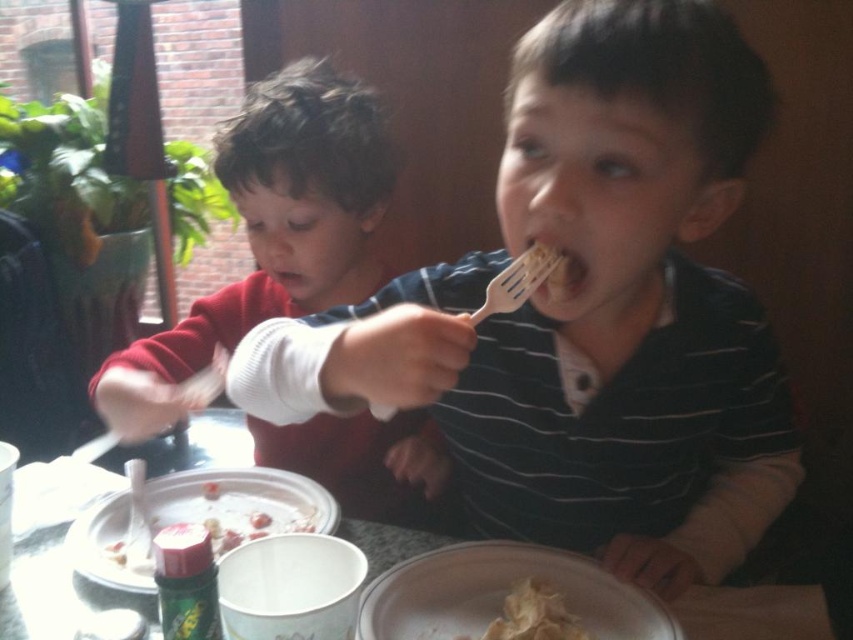
Which is behind, point (9, 598) or point (503, 312)?

Positioned behind is point (503, 312).

Looking at this image, does white plastic table at center appear under white plastic fork at upper center?

Indeed, white plastic table at center is positioned under white plastic fork at upper center.

Does point (120, 595) lie behind point (491, 285)?

That is True.

Locate an element on the screen. white plastic table at center is located at coordinates (55, 592).

Is point (244, 429) closer to camera compared to point (503, 612)?

No, (244, 429) is behind (503, 612).

Is point (144, 604) farther from camera compared to point (569, 616)?

Yes, point (144, 604) is behind point (569, 616).

The image size is (853, 640). What do you see at coordinates (55, 592) in the screenshot? I see `white plastic table at center` at bounding box center [55, 592].

The width and height of the screenshot is (853, 640). I want to click on white plastic table at center, so click(x=55, y=592).

Is white matte plate at lower center in front of white crumbly food at lower center?

That is True.

Looking at this image, does white matte plate at lower center appear on the right side of white crumbly food at lower center?

Incorrect, white matte plate at lower center is not on the right side of white crumbly food at lower center.

Identify the location of white matte plate at lower center. (502, 595).